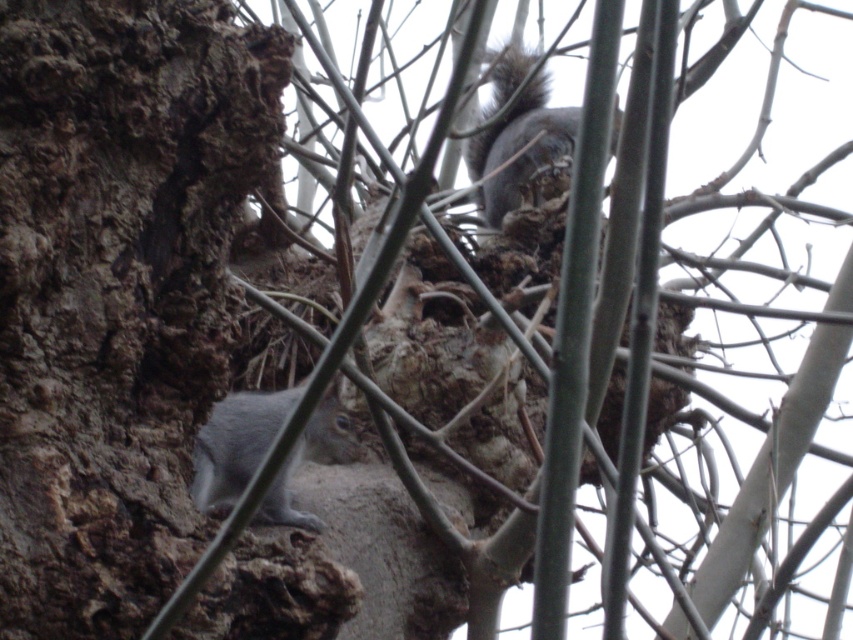
Can you confirm if gray fur squirrel at upper center is taller than gray fur tail at lower left?

Yes, gray fur squirrel at upper center is taller than gray fur tail at lower left.

Which of these two, gray fur squirrel at upper center or gray fur tail at lower left, stands taller?

Standing taller between the two is gray fur squirrel at upper center.

What do you see at coordinates (519, 148) in the screenshot?
I see `gray fur squirrel at upper center` at bounding box center [519, 148].

What are the coordinates of `gray fur squirrel at upper center` in the screenshot? It's located at (519, 148).

How far apart are brown rough bark at left and gray furry squirrel at lower left?

brown rough bark at left is 27.57 centimeters from gray furry squirrel at lower left.

Is point (49, 189) in front of point (260, 452)?

Yes, point (49, 189) is in front of point (260, 452).

The height and width of the screenshot is (640, 853). I want to click on brown rough bark at left, so click(115, 291).

Is the position of gray furry squirrel at lower left more distant than that of gray fur squirrel at upper center?

No, gray furry squirrel at lower left is in front of gray fur squirrel at upper center.

The width and height of the screenshot is (853, 640). Describe the element at coordinates (236, 444) in the screenshot. I see `gray furry squirrel at lower left` at that location.

The image size is (853, 640). Identify the location of gray furry squirrel at lower left. (236, 444).

The image size is (853, 640). Identify the location of gray furry squirrel at lower left. (236, 444).